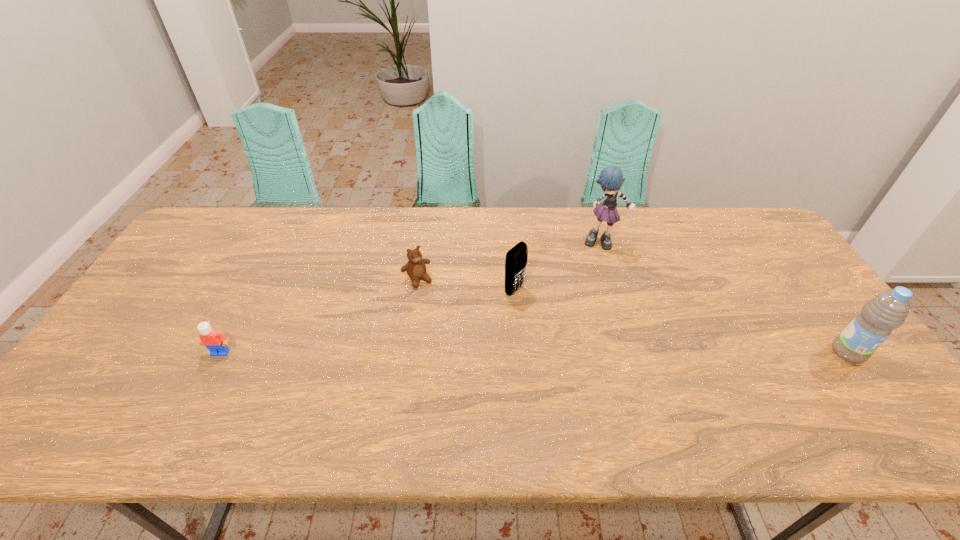
At what (x,y) coordinates should I click in order to perform the action: click on the leftmost object. Please return your answer as a coordinate pair (x, y). This screenshot has height=540, width=960. Looking at the image, I should click on (216, 342).

Where is `water bottle`? water bottle is located at coordinates (887, 311).

At what (x,y) coordinates should I click in order to perform the action: click on the rightmost object. Please return your answer as a coordinate pair (x, y). Looking at the image, I should click on (887, 311).

At what (x,y) coordinates should I click in order to perform the action: click on teddy bear. Please return your answer as a coordinate pair (x, y). This screenshot has height=540, width=960. Looking at the image, I should click on (416, 269).

Image resolution: width=960 pixels, height=540 pixels. What are the coordinates of `cellular telephone` in the screenshot? It's located at (516, 259).

At what (x,y) coordinates should I click in order to perform the action: click on the third object from right to left. Please return your answer as a coordinate pair (x, y). The height and width of the screenshot is (540, 960). Looking at the image, I should click on (516, 259).

This screenshot has height=540, width=960. What are the coordinates of `rag doll` in the screenshot? It's located at (611, 178).

Where is `the tallest object`? Image resolution: width=960 pixels, height=540 pixels. the tallest object is located at coordinates (611, 178).

The image size is (960, 540). Identify the location of free space located on the face of the Lego. (197, 399).

You are a GUI agent. You are given a task and a screenshot of the screen. Output one action in this format:
    pyautogui.click(x=<x>, y=<y>)
    Task: Click on the vacant region located 0.210m on the left of the water bottle
    
    Given the screenshot: What is the action you would take?
    (750, 353)